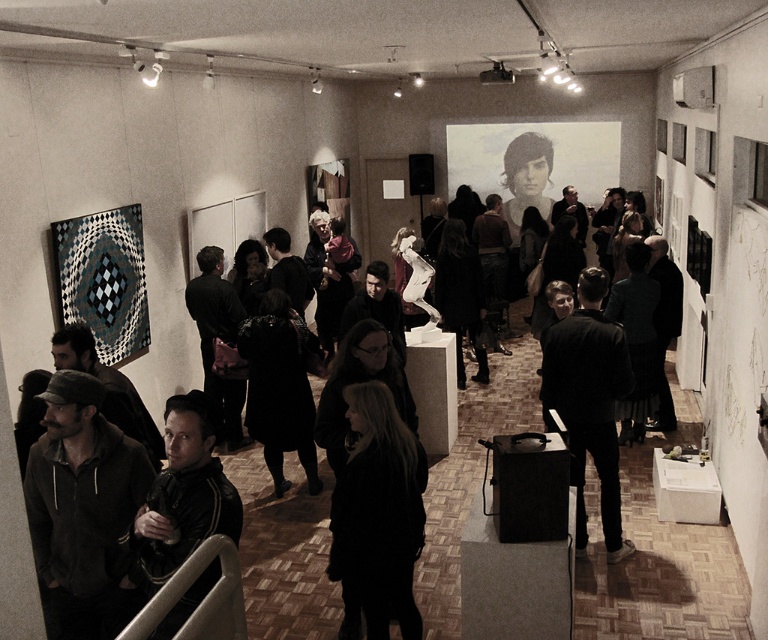
Question: Can you confirm if dark brown suede jacket at lower left is positioned to the right of black leather jacket at center?

Choices:
 (A) yes
 (B) no

Answer: (B)

Question: Is dark brown suede jacket at lower left positioned at the back of dark wool coat at center?

Choices:
 (A) yes
 (B) no

Answer: (B)

Question: Which of these objects is positioned closest to the dark brown suede jacket at lower left?

Choices:
 (A) black leather jacket at center
 (B) dark wool coat at center

Answer: (B)

Question: Which object is positioned closest to the black leather jacket at center?

Choices:
 (A) black leather jacket at lower left
 (B) dark wool coat at center
 (C) dark brown suede jacket at lower left

Answer: (B)

Question: Does black leather jacket at center come behind black leather jacket at lower left?

Choices:
 (A) yes
 (B) no

Answer: (A)

Question: Which of these objects is positioned farthest from the dark brown suede jacket at lower left?

Choices:
 (A) black leather jacket at lower left
 (B) dark wool coat at center
 (C) black leather jacket at center

Answer: (C)